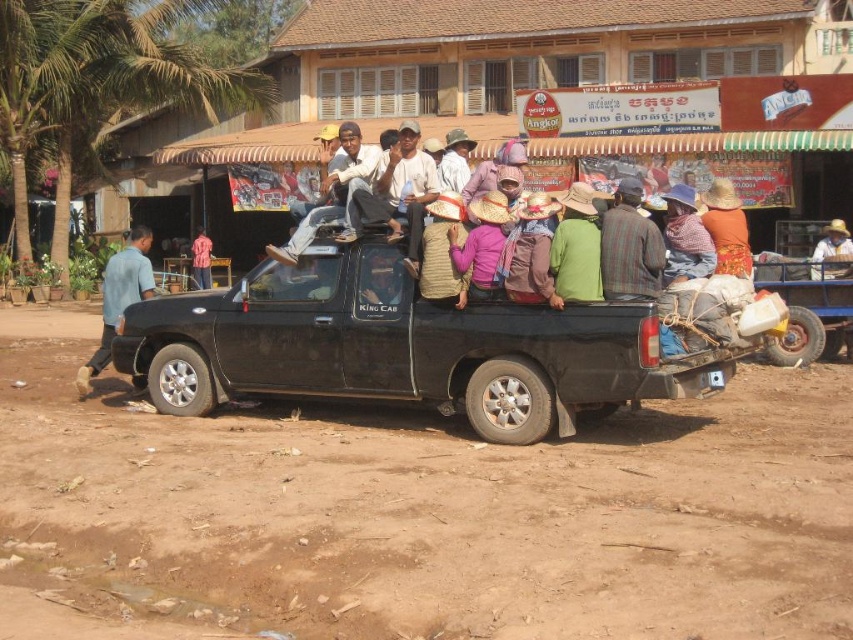
You are a photographer planning to capture a wide shot of the dirt field at lower center and the brown woven basket at center. Given their widths, which object would require you to step back more to include its entire width in the frame?

The dirt field at lower center has a lesser width compared to the brown woven basket at center, so you would need to step back more to include the entire width of the brown woven basket at center in the frame.

You are standing in the scene and want to touch the point at coordinates (119, 298). Which object will you be touching?

The point at coordinates (119, 298) is on the blue cotton shirt at left.

In the scene with the black pickup truck parked on a dirt road, there are two items of clothing visible. The blue cotton shirt at left and the brown woven hat at center. Which of these items is positioned more to the left side of the image?

The blue cotton shirt at left is positioned to the left of the brown woven hat at center, so the blue cotton shirt at left is more to the left side of the image.